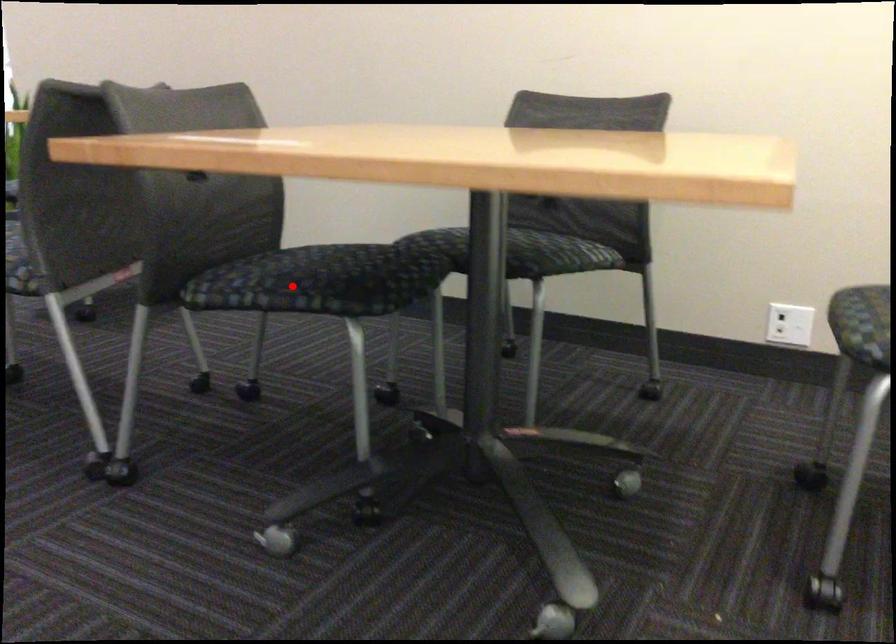
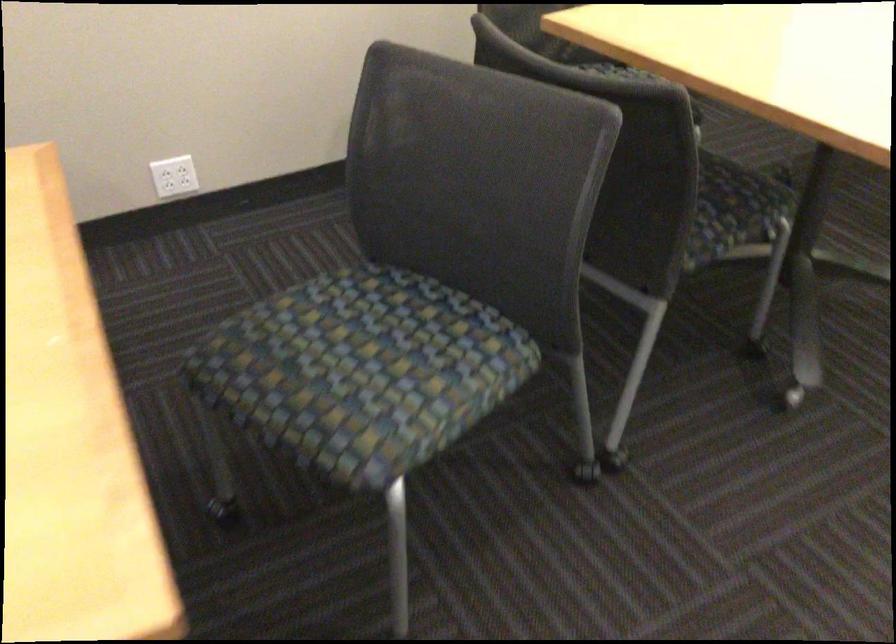
In the second image, find the point that corresponds to the highlighted location in the first image.

(736, 205)